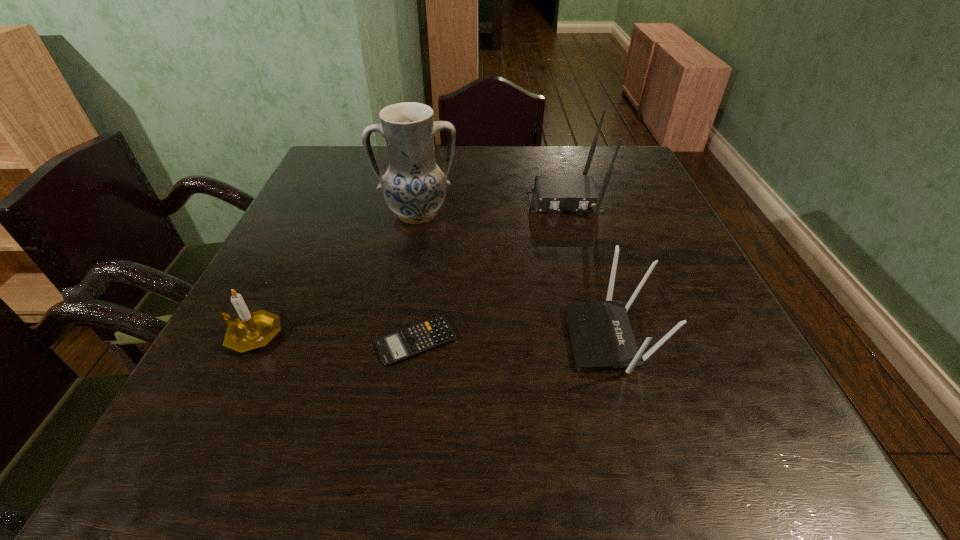
I want to click on unoccupied position between the leftmost object and the calculator, so click(x=334, y=338).

The width and height of the screenshot is (960, 540). I want to click on free area in between the farther router and the shorter router, so [588, 269].

The height and width of the screenshot is (540, 960). What are the coordinates of `free space between the calculator and the candle holder` in the screenshot? It's located at (334, 338).

Where is `free area in between the calculator and the shorter router`? The height and width of the screenshot is (540, 960). free area in between the calculator and the shorter router is located at coordinates (514, 339).

Image resolution: width=960 pixels, height=540 pixels. I want to click on free space between the shortest object and the pottery, so click(418, 278).

You are a GUI agent. You are given a task and a screenshot of the screen. Output one action in this format:
    pyautogui.click(x=<x>, y=<y>)
    Task: Click on the free space between the pottery and the shortest object
    Image resolution: width=960 pixels, height=540 pixels.
    Given the screenshot: What is the action you would take?
    pyautogui.click(x=418, y=278)

Identify the location of free space between the farther router and the nearer router. (588, 269).

The height and width of the screenshot is (540, 960). I want to click on free space that is in between the calculator and the pottery, so click(418, 278).

Where is `unoccupied position between the candle holder and the shortest object`? unoccupied position between the candle holder and the shortest object is located at coordinates (334, 338).

Identify the location of unoccupied position between the shortest object and the pottery. (418, 278).